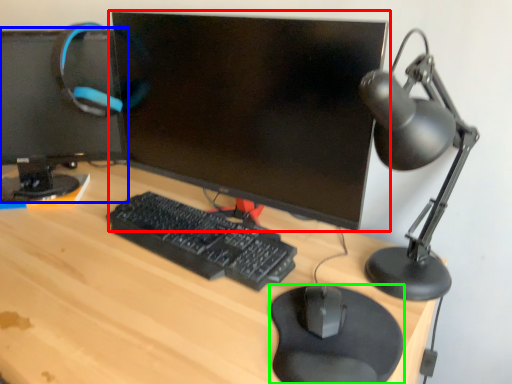
Question: Based on their relative distances, which object is farther from computer monitor (highlighted by a red box)? Choose from computer monitor (highlighted by a blue box) and mousepad (highlighted by a green box).

Choices:
 (A) computer monitor
 (B) mousepad

Answer: (B)